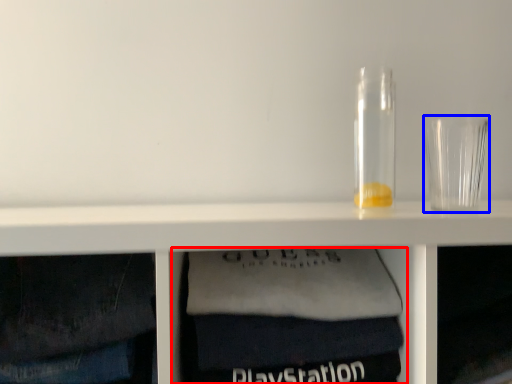
Question: Which object appears farthest to the camera in this image, cabinet (highlighted by a red box) or shot glass (highlighted by a blue box)?

Choices:
 (A) cabinet
 (B) shot glass

Answer: (B)